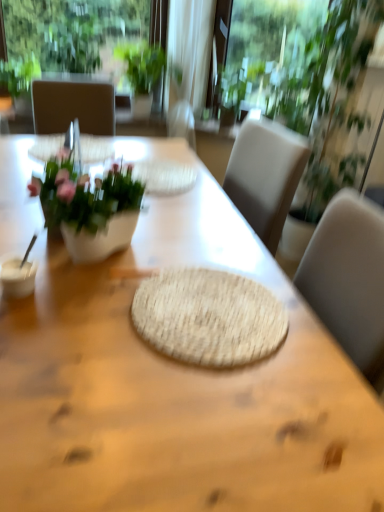
Question: From the image's perspective, is natural woven placemat at center located above natural woven mat at center?

Choices:
 (A) yes
 (B) no

Answer: (B)

Question: Is natural woven mat at center inside natural woven placemat at center?

Choices:
 (A) no
 (B) yes

Answer: (B)

Question: From the image's perspective, is natural woven placemat at center below natural woven mat at center?

Choices:
 (A) yes
 (B) no

Answer: (A)

Question: Are natural woven placemat at center and natural woven mat at center beside each other?

Choices:
 (A) yes
 (B) no

Answer: (B)

Question: Is natural woven placemat at center further to camera compared to natural woven mat at center?

Choices:
 (A) no
 (B) yes

Answer: (A)

Question: In terms of width, does transparent glass window at upper center look wider or thinner when compared to white glossy vase at left?

Choices:
 (A) wide
 (B) thin

Answer: (B)

Question: In the image, is transparent glass window at upper center positioned in front of or behind white glossy vase at left?

Choices:
 (A) front
 (B) behind

Answer: (B)

Question: From the image's perspective, relative to white glossy vase at left, is transparent glass window at upper center above or below?

Choices:
 (A) below
 (B) above

Answer: (B)

Question: Is transparent glass window at upper center spatially inside white glossy vase at left, or outside of it?

Choices:
 (A) outside
 (B) inside

Answer: (A)

Question: In the image, is transparent glass window screen at upper center on the left side or the right side of natural woven placemat at center?

Choices:
 (A) left
 (B) right

Answer: (B)

Question: Considering the positions of transparent glass window screen at upper center and natural woven placemat at center in the image, is transparent glass window screen at upper center taller or shorter than natural woven placemat at center?

Choices:
 (A) short
 (B) tall

Answer: (A)

Question: Relative to natural woven placemat at center, is transparent glass window screen at upper center in front or behind?

Choices:
 (A) front
 (B) behind

Answer: (B)

Question: Choose the correct answer: Is transparent glass window screen at upper center inside natural woven placemat at center or outside it?

Choices:
 (A) outside
 (B) inside

Answer: (A)

Question: From a real-world perspective, relative to transparent glass window at upper center, is green leafy plant at upper right, which is the third houseplant in left-to-right order, vertically above or below?

Choices:
 (A) above
 (B) below

Answer: (B)

Question: Considering their positions, is green leafy plant at upper right, which is the third houseplant in left-to-right order, located in front of or behind transparent glass window at upper center?

Choices:
 (A) behind
 (B) front

Answer: (B)